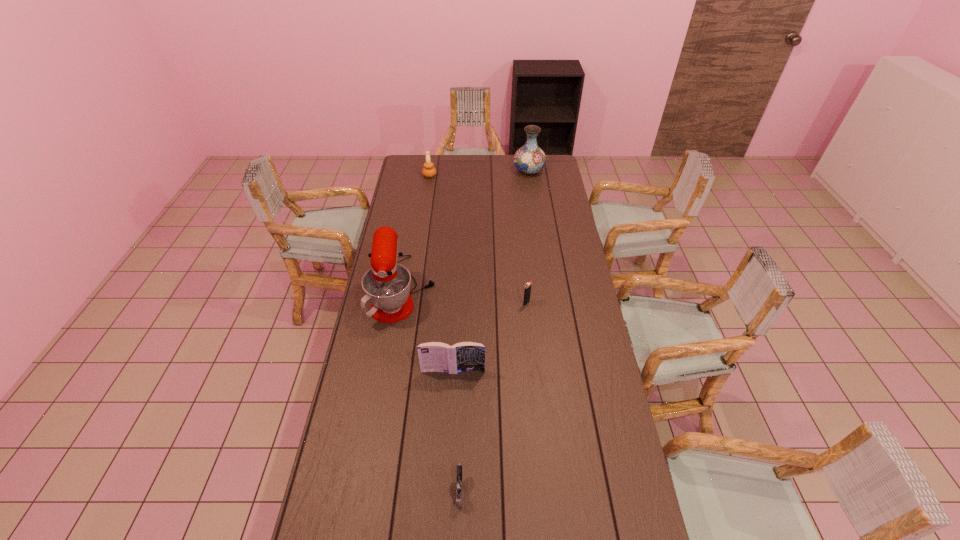
The height and width of the screenshot is (540, 960). I want to click on vacant space that satisfies the following two spatial constraints: 1. on the back side of the farther igniter; 2. on the bowl side of the mixer, so click(x=525, y=289).

This screenshot has width=960, height=540. Find the location of `vacant area that satisfies the following two spatial constraints: 1. on the front side of the vase; 2. on the bowl side of the mixer`. vacant area that satisfies the following two spatial constraints: 1. on the front side of the vase; 2. on the bowl side of the mixer is located at coordinates (546, 289).